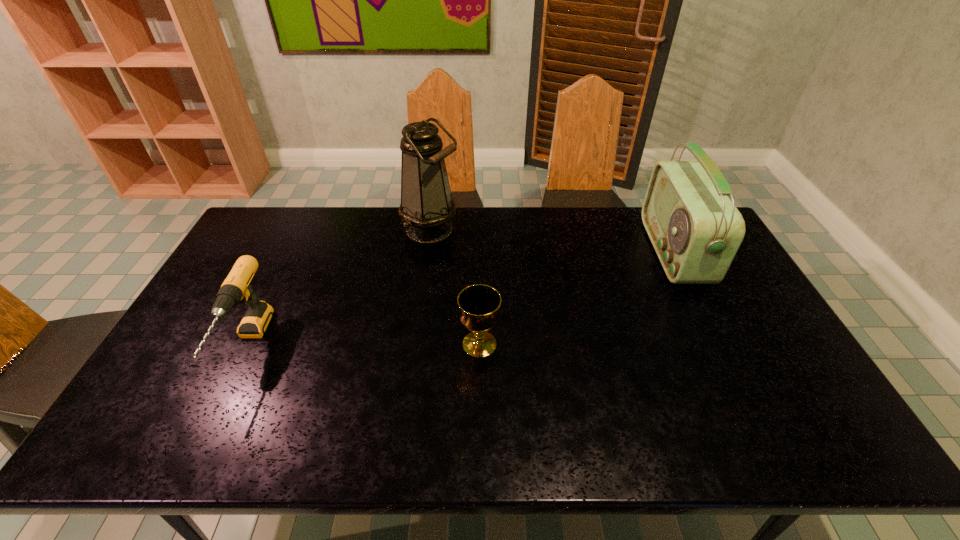
You are a GUI agent. You are given a task and a screenshot of the screen. Output one action in this format:
    pyautogui.click(x=<x>, y=<y>)
    Task: Click on the vacant space located 0.100m on the back of the second object from right to left
    
    Given the screenshot: What is the action you would take?
    click(x=480, y=303)

Where is `oil lamp positioned at the far edge`? oil lamp positioned at the far edge is located at coordinates (427, 206).

Identify the location of radio receiver at the far edge. The image size is (960, 540). (695, 229).

Image resolution: width=960 pixels, height=540 pixels. Find the location of `object situated at the right edge`. object situated at the right edge is located at coordinates (695, 229).

This screenshot has height=540, width=960. Identify the location of object that is at the far right corner. (695, 229).

In the image, there is a desktop. What are the coordinates of `vacant space at the far edge` in the screenshot? It's located at (x=348, y=217).

The height and width of the screenshot is (540, 960). I want to click on vacant space at the near edge of the desktop, so click(x=410, y=454).

This screenshot has width=960, height=540. In the image, there is a desktop. Find the location of `free space at the left edge`. free space at the left edge is located at coordinates (188, 345).

This screenshot has width=960, height=540. Identify the location of free space at the right edge of the desktop. (804, 379).

The image size is (960, 540). Identify the location of free spot at the near left corner of the desktop. (157, 448).